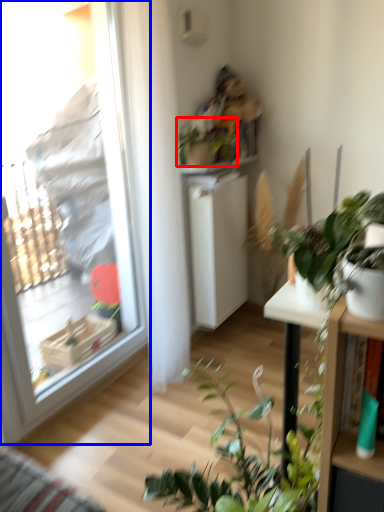
Question: Which point is closer to the camera, houseplant (highlighted by a red box) or window (highlighted by a blue box)?

Choices:
 (A) houseplant
 (B) window

Answer: (B)